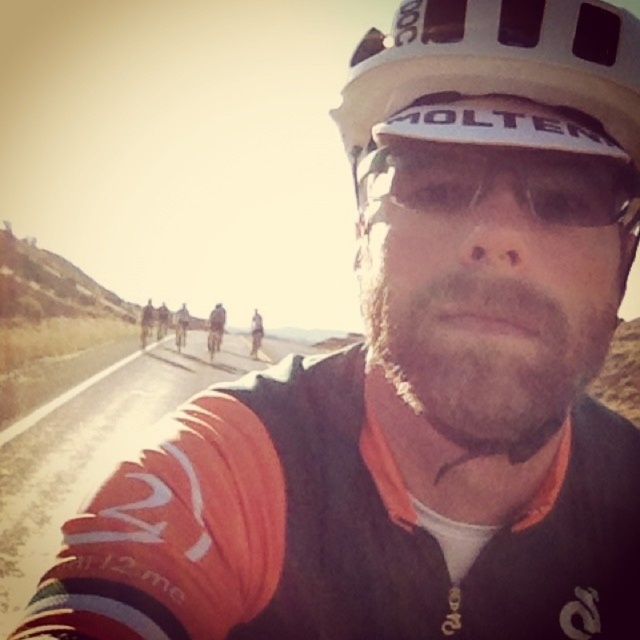
Does point (522, 84) come farther from viewer compared to point (420, 161)?

No, it is in front of (420, 161).

Does white matte helmet at center come in front of transparent plastic goggles at center?

Yes, it is in front of transparent plastic goggles at center.

Is point (392, 77) closer to camera compared to point (362, 172)?

Yes, it is in front of point (362, 172).

Identify the location of white matte helmet at center. (497, 76).

Is white matte bicycle helmet at center in front of dark brown leather jacket at center?

Yes, white matte bicycle helmet at center is in front of dark brown leather jacket at center.

Can you confirm if white matte bicycle helmet at center is smaller than dark brown leather jacket at center?

Indeed, white matte bicycle helmet at center has a smaller size compared to dark brown leather jacket at center.

What do you see at coordinates (497, 61) in the screenshot? The height and width of the screenshot is (640, 640). I see `white matte bicycle helmet at center` at bounding box center [497, 61].

Locate an element on the screen. The height and width of the screenshot is (640, 640). white matte bicycle helmet at center is located at coordinates (497, 61).

Can you confirm if white matte bicycle helmet at center is thinner than transparent plastic goggles at center?

No, white matte bicycle helmet at center is not thinner than transparent plastic goggles at center.

How distant is white matte bicycle helmet at center from transparent plastic goggles at center?

white matte bicycle helmet at center is 6.17 centimeters away from transparent plastic goggles at center.

Image resolution: width=640 pixels, height=640 pixels. Describe the element at coordinates (497, 61) in the screenshot. I see `white matte bicycle helmet at center` at that location.

Identify the location of white matte bicycle helmet at center. This screenshot has height=640, width=640. (497, 61).